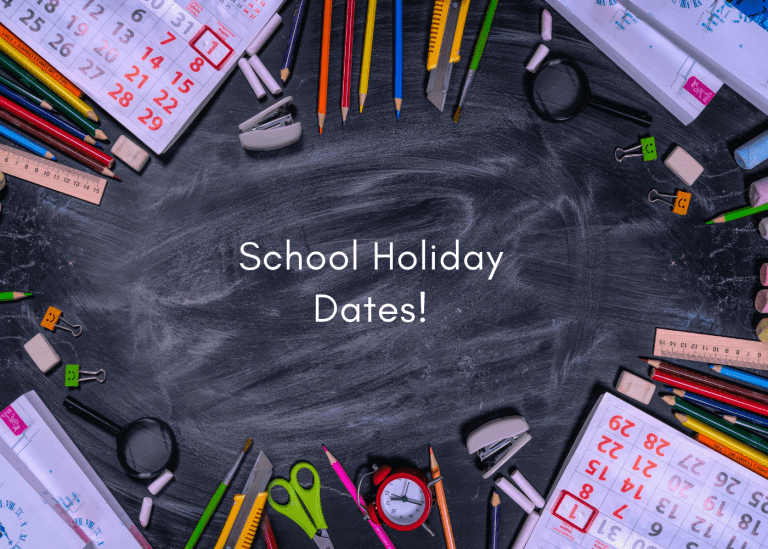
At what (x,y) coordinates should I click in order to perform the action: click on calendar. Please return your answer as a coordinate pair (x, y). The width and height of the screenshot is (768, 549). Looking at the image, I should click on (149, 80), (629, 472).